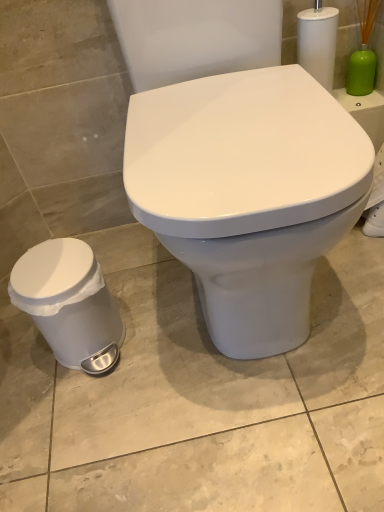
You are a GUI agent. You are given a task and a screenshot of the screen. Output one action in this format:
    pyautogui.click(x=<x>, y=<y>)
    Task: Click on the vacant area that is situated to the right of white plastic trash can at lower left
    
    Given the screenshot: What is the action you would take?
    click(163, 330)